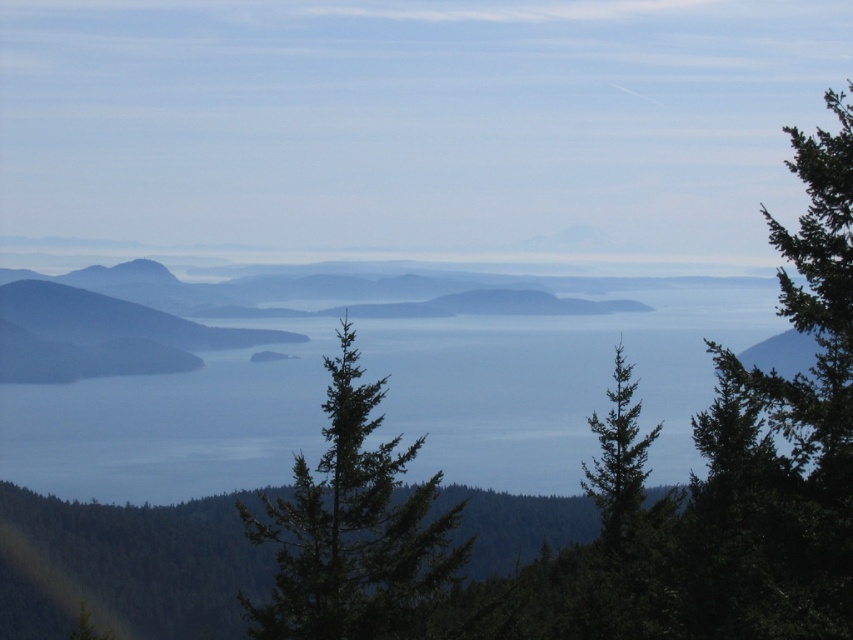
You are standing at the point with coordinates point (x=560, y=384). What is the color of the surface you are currently standing on?

The surface at point (x=560, y=384) is blue water at center, so the color is blue.